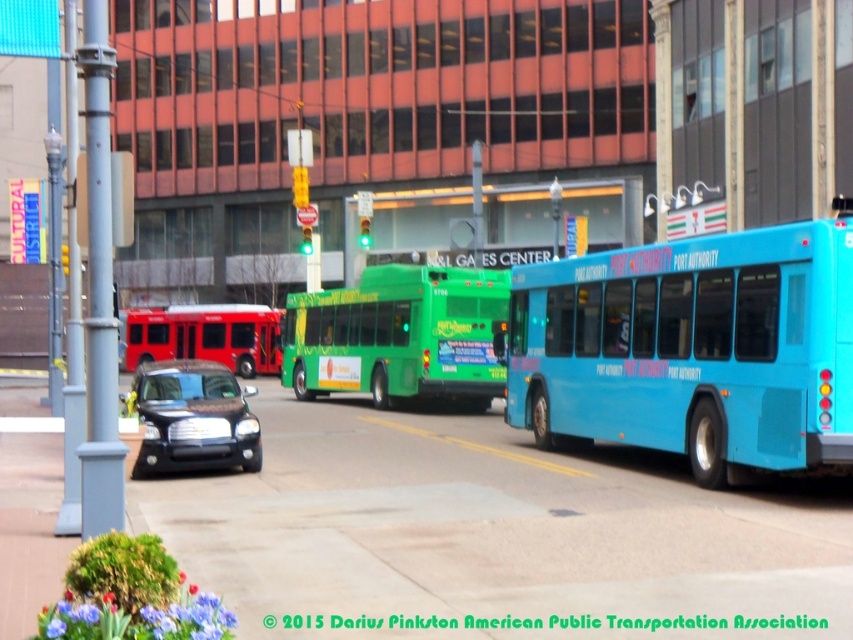
You are a pedestrian standing on the sidewalk looking at the blue rubber bus at right and the satin black sedan at center. Which vehicle is higher up in the image?

The blue rubber bus at right is located above the satin black sedan at center in the image.

You are a pedestrian standing on the sidewalk and want to cross the street. You see the blue rubber bus at right and the green matte bus at center. Which bus is closer to the sidewalk?

The green matte bus at center is closer to the sidewalk because the blue rubber bus at right is positioned to its right, meaning it is further away from the pedestrian on the sidewalk.